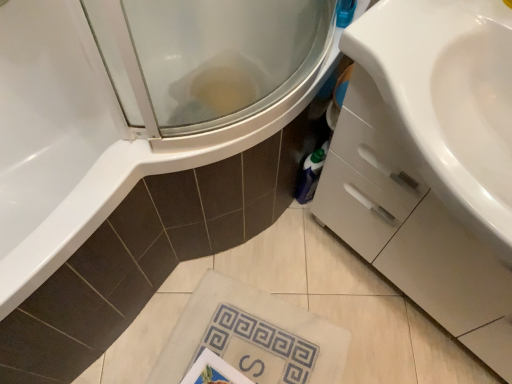
This screenshot has height=384, width=512. Find the location of `free point above white textured towel at lower center (from a real-world perspective)`. free point above white textured towel at lower center (from a real-world perspective) is located at coordinates (252, 344).